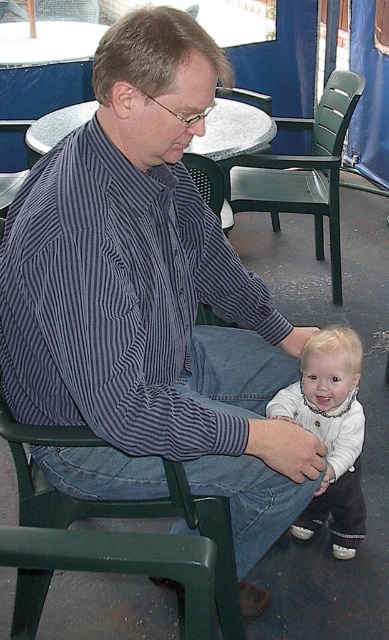
Question: Which object is closer to the camera taking this photo?

Choices:
 (A) green plastic chair at lower left
 (B) white soft fabric baby at lower center

Answer: (A)

Question: Is green plastic chair at lower left below green plastic chair at center?

Choices:
 (A) no
 (B) yes

Answer: (B)

Question: Among these points, which one is nearest to the camera?

Choices:
 (A) (322, 168)
 (B) (217, 554)
 (C) (353, 349)

Answer: (B)

Question: Can you confirm if green plastic chair at lower left is bigger than green plastic chair at center?

Choices:
 (A) yes
 (B) no

Answer: (B)

Question: Which point is farther from the camera taking this photo?

Choices:
 (A) (70, 433)
 (B) (346, 72)

Answer: (B)

Question: Observing the image, what is the correct spatial positioning of white soft fabric baby at lower center in reference to green plastic chair at center?

Choices:
 (A) right
 (B) left

Answer: (B)